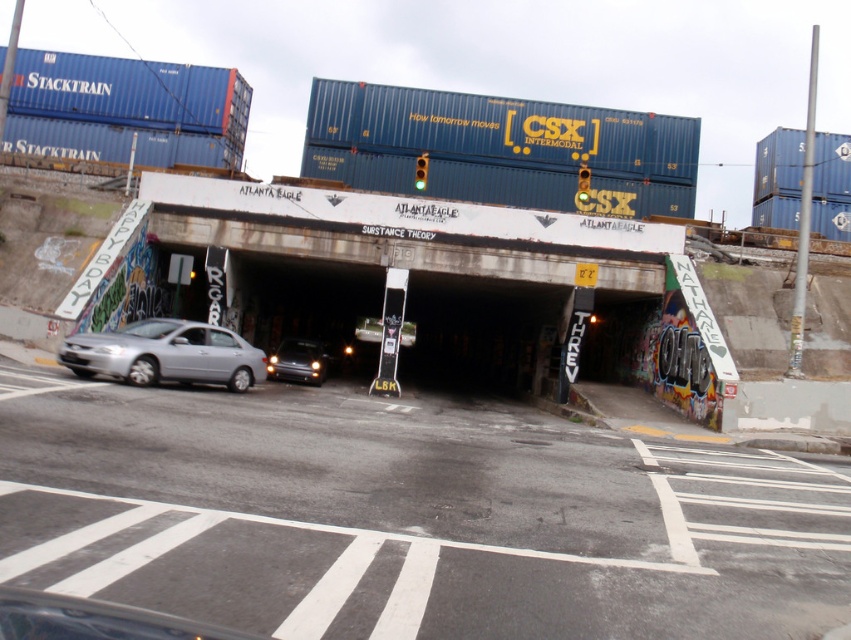
You are a photographer planning to capture both the blue matte container at upper left and the silver metallic car at lower left in a single frame. Given their sizes, which object should you position closer to the camera to ensure both fit in the frame without cropping?

Since the blue matte container at upper left is wider than the silver metallic car at lower left, you should position the silver metallic car at lower left closer to the camera. This way, its apparent size increases, balancing the sizes of both objects in the frame.

You are a delivery driver who needs to park your silver metallic car at lower left as close as possible to the CSX Intermodal shipping container above the railway underpass. Given the coordinates of the car at point 0.555, 0.196, can you estimate how close you can get to the container?

The silver metallic car at lower left is positioned at coordinates (x=166, y=355), which is the closest possible point to the CSX Intermodal shipping container above the railway underpass. Therefore, the car is already at the optimal parking spot.

Based on the photo, you are a delivery driver who needs to park your car, which is 5 meters long, between the silver metallic car at lower left and the blue matte shipping container at upper right. Is there enough space for your car to fit without touching either object?

The silver metallic car at lower left and blue matte shipping container at upper right are 24.79 meters apart. Since your car is only 5 meters long, there is ample space between them to park without touching either object.